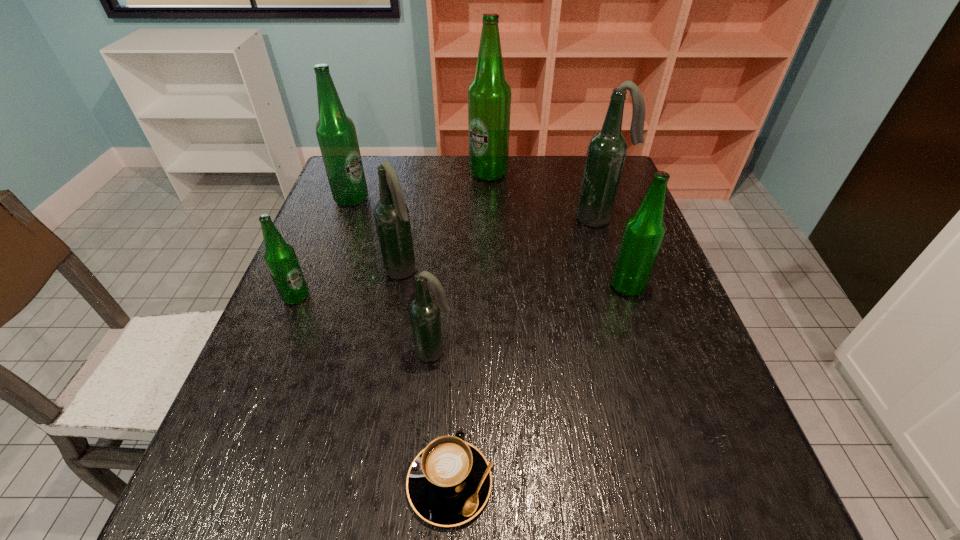
Identify which dark beer bottle is located as the second nearest to the second smallest green beer bottle. Please provide its 2D coordinates. Your answer should be formatted as a tuple, i.e. [(x, y)], where the tuple contains the x and y coordinates of a point satisfying the conditions above.

[(424, 310)]

Locate an element on the screen. Image resolution: width=960 pixels, height=540 pixels. free space that satisfies the following two spatial constraints: 1. on the label of the fourth beer bottle from right to left; 2. on the left side of the third smallest green beer bottle is located at coordinates (295, 352).

Where is `vacant region that satisfies the following two spatial constraints: 1. on the label of the sixth nearest beer bottle; 2. on the right side of the rightmost dark beer bottle`? This screenshot has height=540, width=960. vacant region that satisfies the following two spatial constraints: 1. on the label of the sixth nearest beer bottle; 2. on the right side of the rightmost dark beer bottle is located at coordinates (345, 219).

Find the location of a particular element. Image resolution: width=960 pixels, height=540 pixels. vacant position in the image that satisfies the following two spatial constraints: 1. on the label of the tallest object; 2. on the label of the second biggest green beer bottle is located at coordinates [x=489, y=199].

Locate an element on the screen. The width and height of the screenshot is (960, 540). free point that satisfies the following two spatial constraints: 1. on the label of the third farthest object; 2. on the right side of the farthest green beer bottle is located at coordinates (490, 219).

The width and height of the screenshot is (960, 540). What are the coordinates of `free space that satisfies the following two spatial constraints: 1. on the label of the second farthest object; 2. on the right side of the second smallest dark beer bottle` in the screenshot? It's located at click(324, 272).

I want to click on vacant region that satisfies the following two spatial constraints: 1. on the label of the smallest green beer bottle; 2. on the left side of the cappuccino, so click(220, 483).